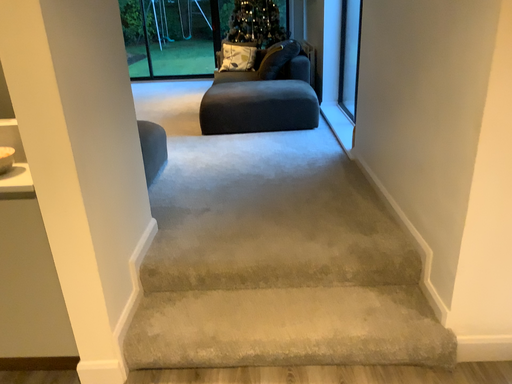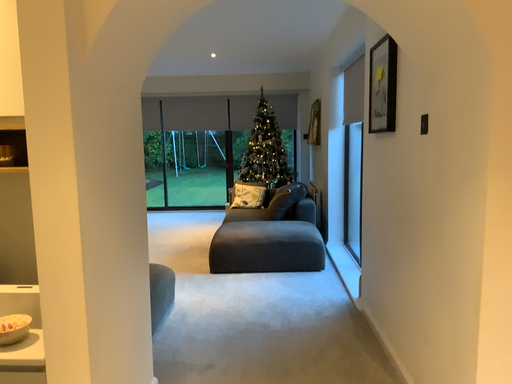
Question: Which way did the camera rotate in the video?

Choices:
 (A) rotated downward
 (B) rotated upward

Answer: (B)